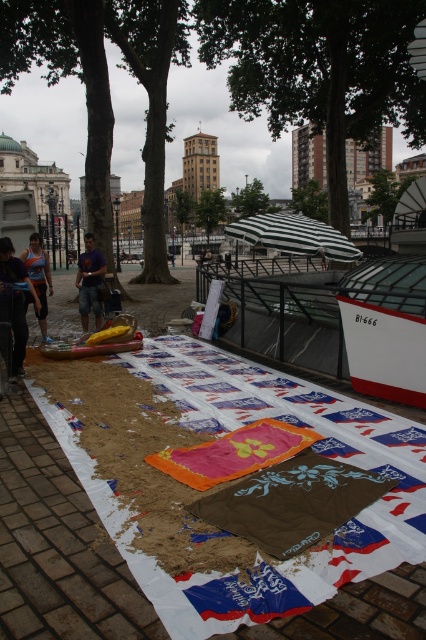
Who is positioned more to the right, purple cotton t-shirt at center or orange athletic top at center?

purple cotton t-shirt at center is more to the right.

Is purple cotton t-shirt at center taller than orange athletic top at center?

Indeed, purple cotton t-shirt at center has a greater height compared to orange athletic top at center.

The image size is (426, 640). What do you see at coordinates (89, 282) in the screenshot?
I see `purple cotton t-shirt at center` at bounding box center [89, 282].

Find the location of a particular element. This screenshot has height=640, width=426. purple cotton t-shirt at center is located at coordinates (89, 282).

Between point (28, 422) and point (3, 310), which one is positioned in front?

Point (28, 422) is more forward.

Does brown paper at center have a smaller size compared to blue denim jeans at lower left?

Incorrect, brown paper at center is not smaller in size than blue denim jeans at lower left.

This screenshot has height=640, width=426. What do you see at coordinates (57, 545) in the screenshot?
I see `brown paper at center` at bounding box center [57, 545].

You are a GUI agent. You are given a task and a screenshot of the screen. Output one action in this format:
    pyautogui.click(x=<x>, y=<y>)
    Task: Click on the brown paper at center
    This screenshot has height=640, width=426.
    Given the screenshot: What is the action you would take?
    pyautogui.click(x=57, y=545)

Does purple cotton t-shirt at center appear on the left side of yellow plastic kayak at center?

Yes, purple cotton t-shirt at center is to the left of yellow plastic kayak at center.

The width and height of the screenshot is (426, 640). What do you see at coordinates (89, 282) in the screenshot?
I see `purple cotton t-shirt at center` at bounding box center [89, 282].

Is point (103, 272) positioned after point (80, 344)?

Yes, point (103, 272) is farther from viewer.

Where is `purple cotton t-shirt at center`? purple cotton t-shirt at center is located at coordinates (89, 282).